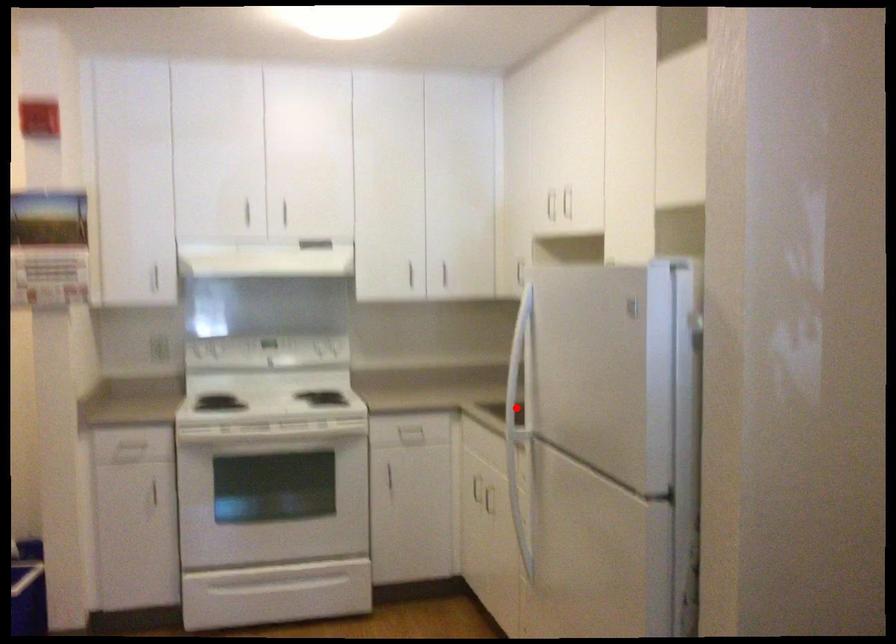
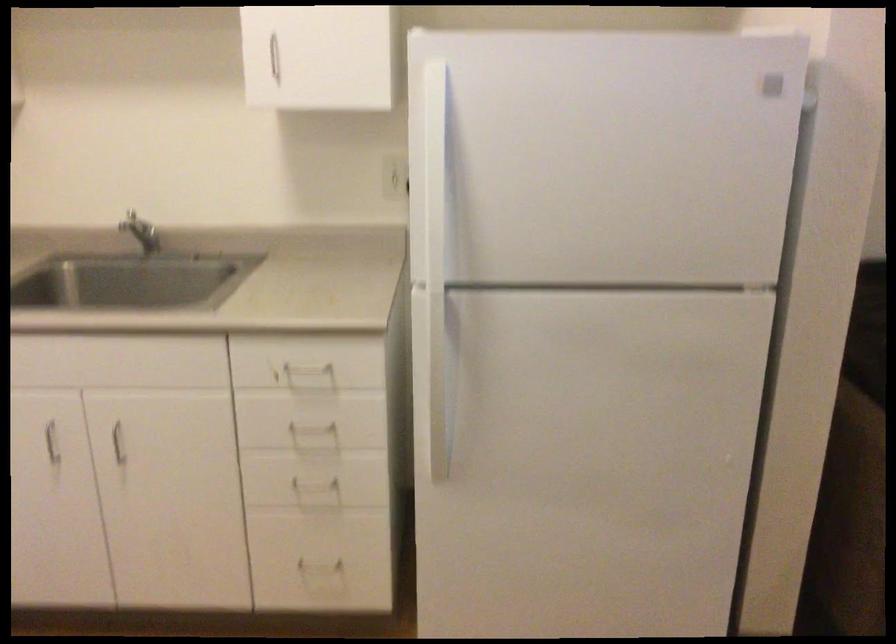
Question: I am providing you with two images of the same scene from different viewpoints. In image1, a red point is highlighted. Considering the same 3D point in image2, which of the following is correct?

Choices:
 (A) It is closer
 (B) It is farther

Answer: (A)